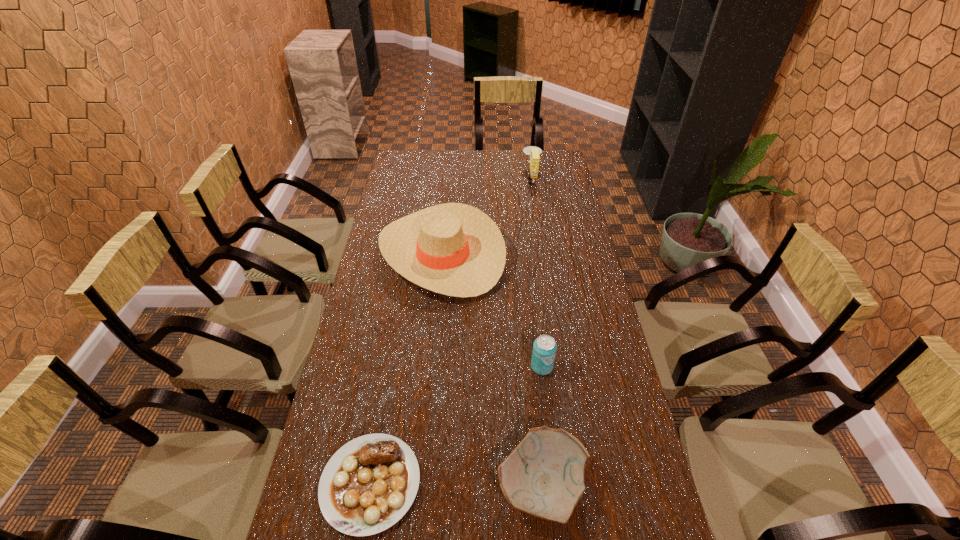
Locate an element on the screen. This screenshot has height=540, width=960. vacant space located 0.070m on the right of the beer can is located at coordinates (577, 367).

The image size is (960, 540). In order to click on vacant space situated 0.080m on the left of the pottery in this screenshot , I will do `click(464, 485)`.

Where is `free space located on the right of the shortest object`? This screenshot has height=540, width=960. free space located on the right of the shortest object is located at coordinates (491, 483).

Where is `object at the far edge`? The image size is (960, 540). object at the far edge is located at coordinates (533, 151).

Find the location of a particular element. The width and height of the screenshot is (960, 540). sunhat that is at the left edge is located at coordinates (454, 249).

The width and height of the screenshot is (960, 540). What are the coordinates of `steak present at the left edge` in the screenshot? It's located at (368, 485).

Where is `sponge at the right edge`? This screenshot has width=960, height=540. sponge at the right edge is located at coordinates (533, 151).

Identify the location of pottery at the right edge. (544, 476).

Find the location of a particular element. Image resolution: width=960 pixels, height=540 pixels. object that is at the far right corner is located at coordinates (533, 151).

The width and height of the screenshot is (960, 540). In the image, there is a desktop. Identify the location of vacant space at the far edge. (475, 157).